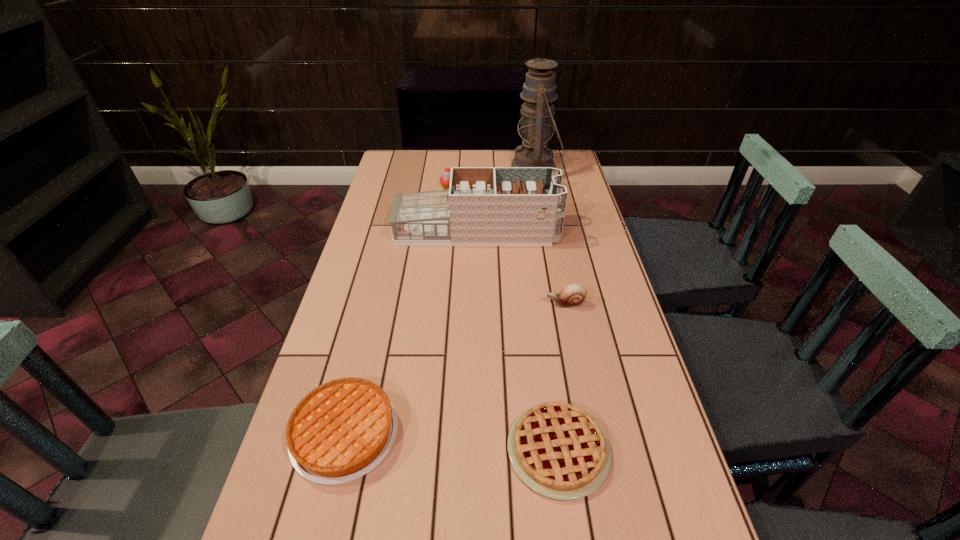
Identify the location of free location that satisfies the following two spatial constraints: 1. on the back side of the tallest object; 2. on the right side of the cupcake. The height and width of the screenshot is (540, 960). (450, 167).

I want to click on free space that satisfies the following two spatial constraints: 1. on the front side of the shortest object; 2. on the left side of the cupcake, so click(420, 450).